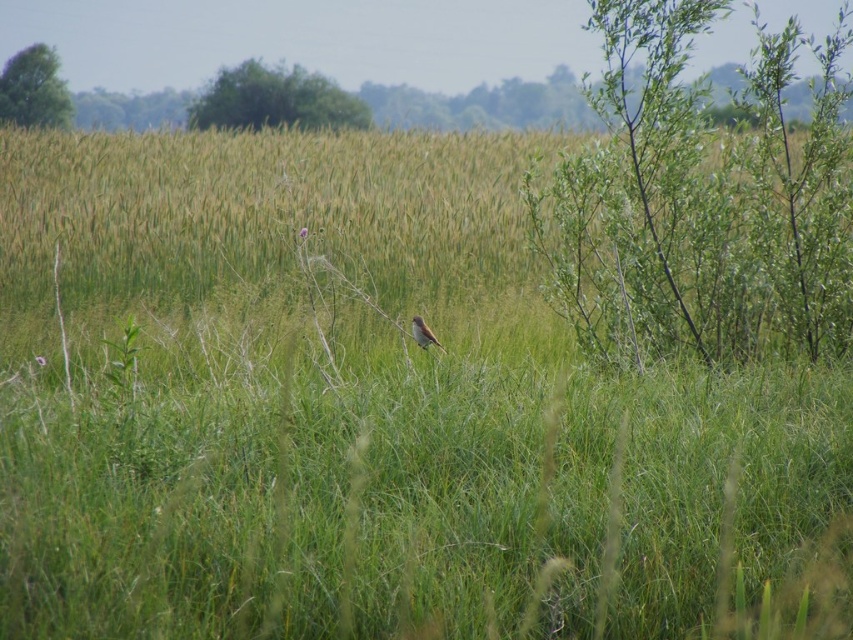
Which is below, green leafy plant at right or brown feathered bird at center?

brown feathered bird at center is lower down.

Does point (616, 3) come farther from viewer compared to point (421, 333)?

That is True.

Is point (792, 268) farther from camera compared to point (421, 321)?

Yes, it is.

Identify the location of green leafy plant at right. Image resolution: width=853 pixels, height=640 pixels. (697, 196).

Does green grassy wheat field at center appear under green leafy plant at right?

Indeed, green grassy wheat field at center is positioned under green leafy plant at right.

Who is higher up, green grassy wheat field at center or green leafy plant at right?

green leafy plant at right is above.

Find the location of a particular element. This screenshot has height=640, width=853. green grassy wheat field at center is located at coordinates (264, 211).

Is green grassy wheat field at center shorter than brown feathered bird at center?

In fact, green grassy wheat field at center may be taller than brown feathered bird at center.

Who is positioned more to the right, green grassy wheat field at center or brown feathered bird at center?

brown feathered bird at center

Which is behind, point (424, 218) or point (416, 328)?

The point (424, 218) is behind.

Locate an element on the screen. The width and height of the screenshot is (853, 640). green grassy wheat field at center is located at coordinates (264, 211).